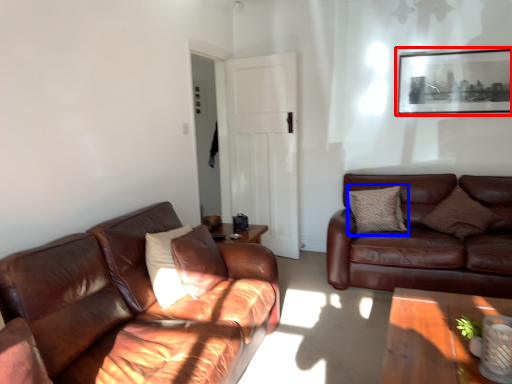
Question: Among these objects, which one is farthest to the camera, picture frame (highlighted by a red box) or pillow (highlighted by a blue box)?

Choices:
 (A) picture frame
 (B) pillow

Answer: (A)